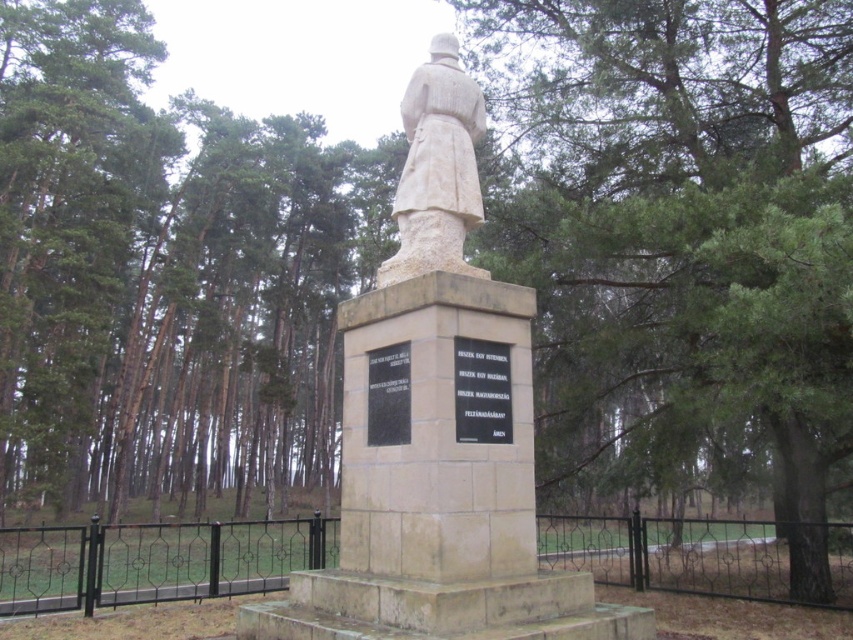
You are a tour guide explaining the statue and plaque to visitors. You want to ensure everyone can see both the white stone statue at center and the black polished stone plaque at center. Where should you position yourself and the group to ensure both are visible?

You should position yourself and the group in front of the white stone statue at center so that you can see both the statue and the black polished stone plaque at center located behind it.

You are standing in front of the statue and want to determine which of the two points, point (456,140) or point (473,346), is closer to you. Based on the coordinates provided, which point is nearer?

Point (456,140) is closer to you because it is further to the viewer than point (473,346).

You are a tourist visiting the statue and want to read the inscription on the black polished stone plaque at center. However, there is a black wrought iron fence at lower center in your way. Can you step around the fence to get a closer look at the plaque?

The black polished stone plaque at center is behind the black wrought iron fence at lower center, so you cannot step around the fence to get closer to the plaque because the plaque is located behind the fence, not beside it.